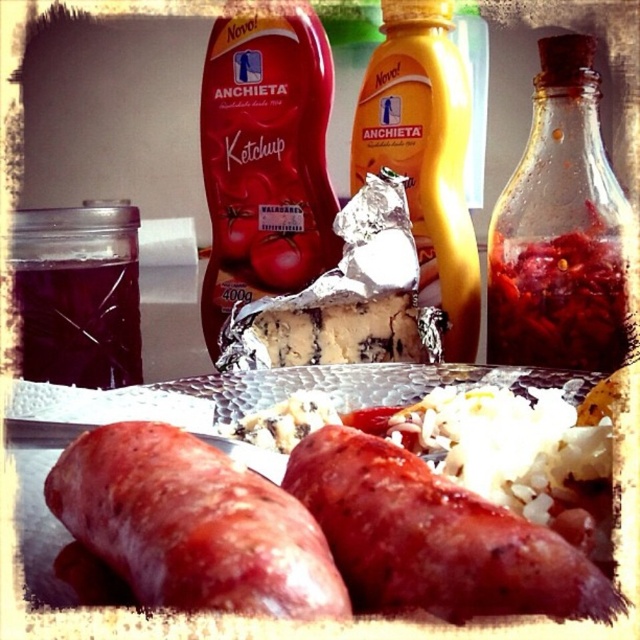
You are setting up a picnic basket and need to place the translucent glass jar at upper right and the yellow matte bottle at center. Based on their positions in the image, which one should you place first to maintain the original arrangement?

The yellow matte bottle at center should be placed first since the translucent glass jar at upper right is positioned to its right, meaning the bottle is on the left side of the jar in the original setup.

You are setting up a table for a dinner party and need to arrange the red glossy sausage at lower left and the yellow matte bottle at center. If you want to place them side by side, which one should be placed first to ensure they fit properly?

The red glossy sausage at lower left is shorter than the yellow matte bottle at center, so you should place the yellow matte bottle at center first to accommodate its height, then place the red glossy sausage at lower left next to it.

What object is located at the coordinates point (435, 538)?

The red glossy sausage at center is located at point (435, 538).